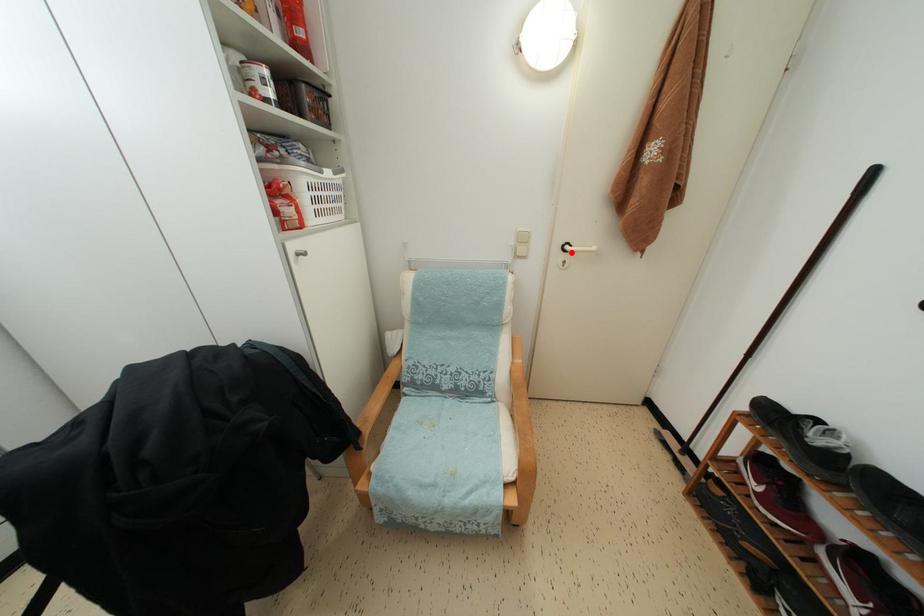
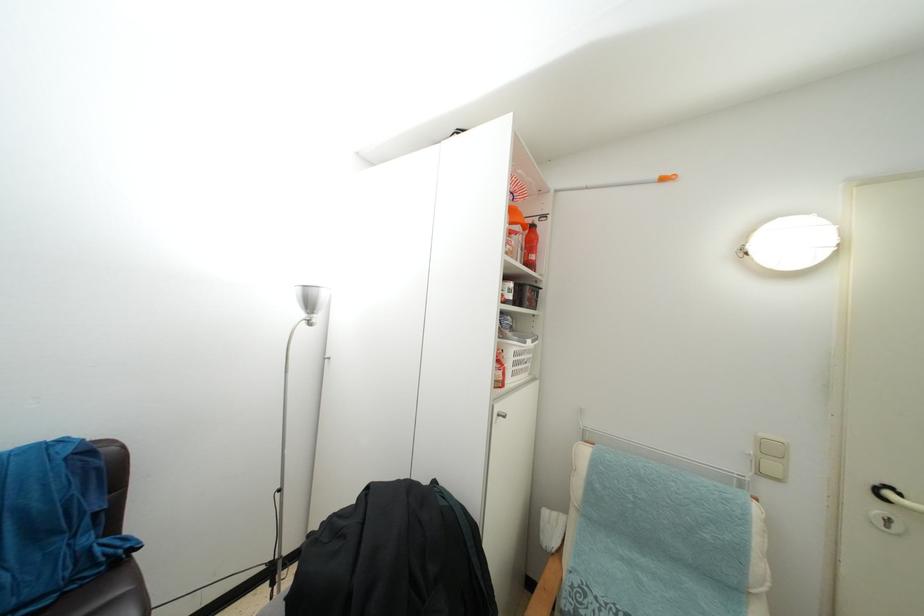
Locate, in the second image, the point that corresponds to the highlighted location in the first image.

(893, 500)